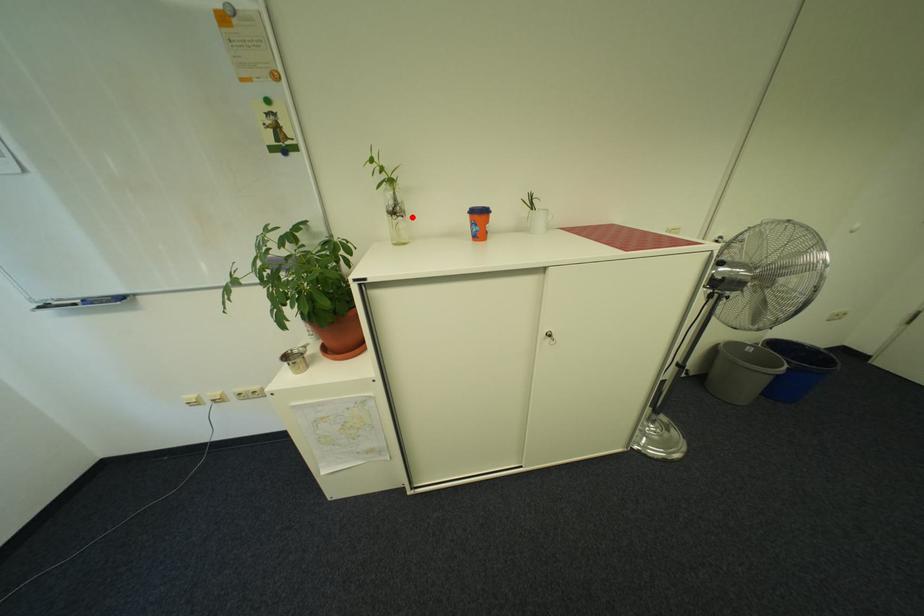
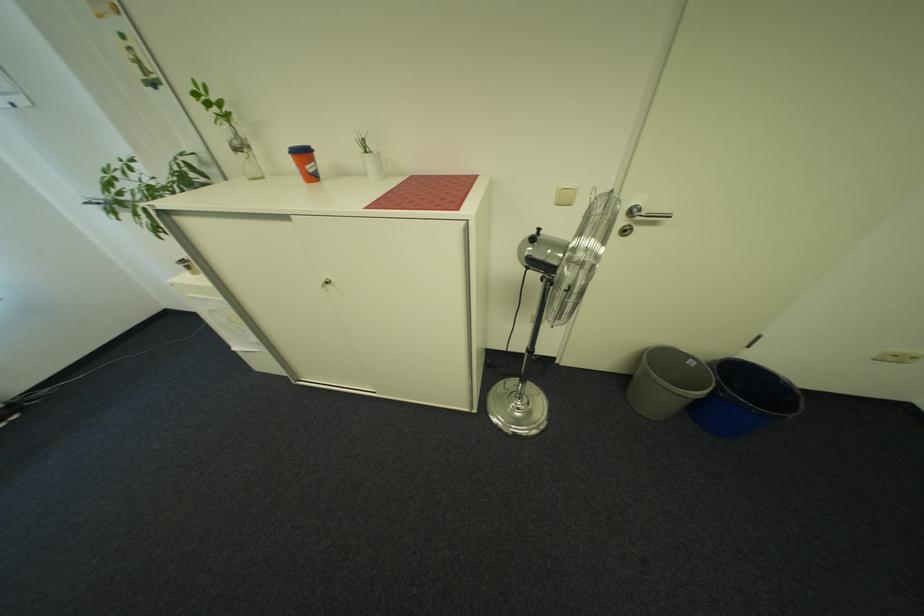
The point at the highlighted location is marked in the first image. Where is the corresponding point in the second image?

(252, 153)